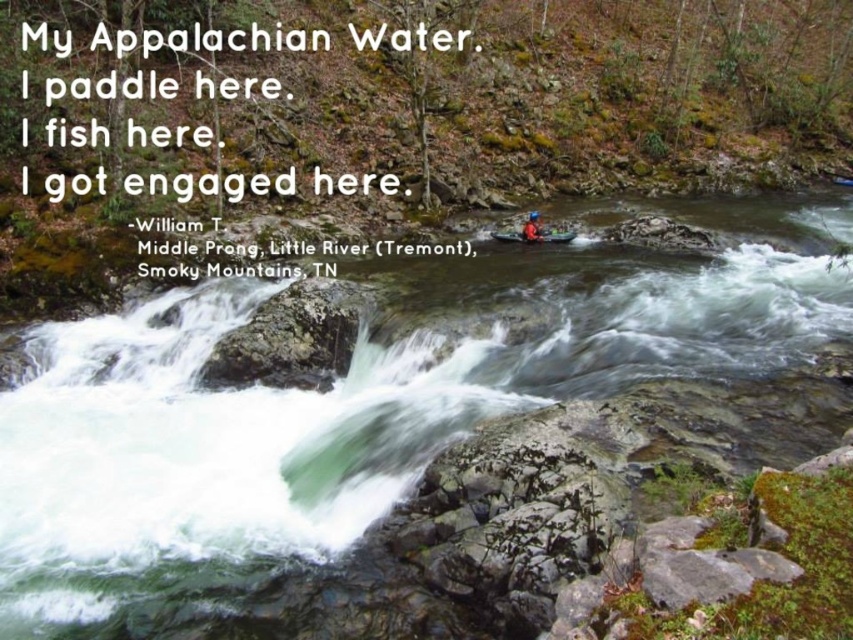
You are a kayaker navigating the Middle Prong of Little River in Tremont. You see two points marked on your GPS map. The first point is at coordinates point [496,237] and the second point is at point [532,211]. Based on the river flow direction, which point should you aim for first to follow the river current?

You should aim for point [496,237] first because it is in front of point [532,211] along the river current direction.

You are a kayaker preparing to navigate the Middle Prong of Little River. You see the white frothy water at center and the matte red kayak at center. Which object is positioned to the right of the other?

The white frothy water at center is to the right of the matte red kayak at center.

You are a photographer planning to capture the kayaks in the river scene. You want to ensure both the matte red kayak at center and the orange fabric kayak at upper right are visible in your shot. Based on their positions, which kayak should you focus on first to frame both effectively?

The matte red kayak at center is positioned on the left side of the orange fabric kayak at upper right, so focusing on the matte red kayak at center first would help frame both effectively as it is closer to the left edge of the scene.